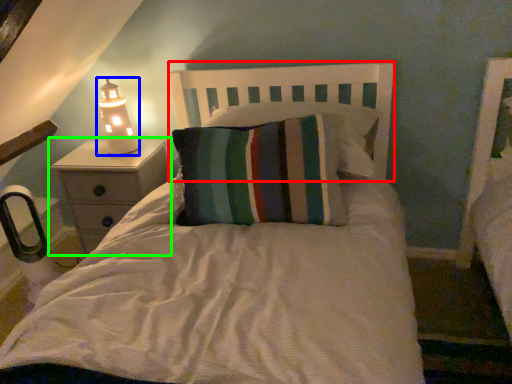
Question: Which object is positioned closest to headboard (highlighted by a red box)? Select from lamp (highlighted by a blue box) and nightstand (highlighted by a green box).

Choices:
 (A) lamp
 (B) nightstand

Answer: (B)